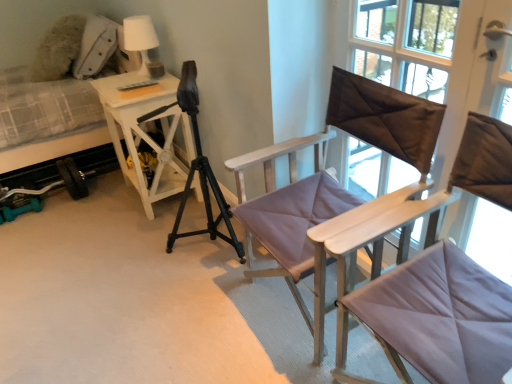
Where is `vacant area that lies in front of white wood side table at left`? The height and width of the screenshot is (384, 512). vacant area that lies in front of white wood side table at left is located at coordinates (134, 236).